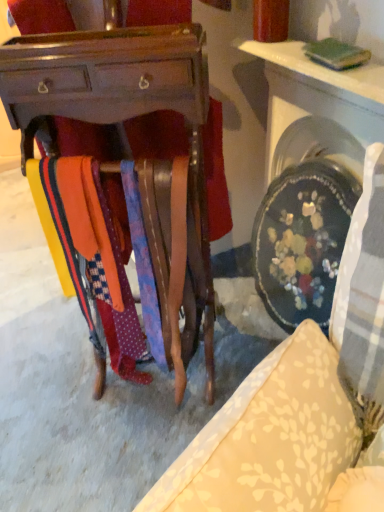
Question: Is wooden tie rack at center completely or partially inside wooden desk at center?

Choices:
 (A) no
 (B) yes

Answer: (A)

Question: Is wooden desk at center thinner than wooden tie rack at center?

Choices:
 (A) no
 (B) yes

Answer: (B)

Question: Is wooden desk at center at the right side of wooden tie rack at center?

Choices:
 (A) yes
 (B) no

Answer: (A)

Question: Is wooden desk at center oriented away from wooden tie rack at center?

Choices:
 (A) no
 (B) yes

Answer: (A)

Question: From a real-world perspective, does wooden desk at center stand above wooden tie rack at center?

Choices:
 (A) yes
 (B) no

Answer: (A)

Question: Considering the relative positions of wooden tie rack at center and orange fabric at center in the image provided, is wooden tie rack at center to the left or to the right of orange fabric at center?

Choices:
 (A) left
 (B) right

Answer: (A)

Question: From their relative heights in the image, would you say wooden tie rack at center is taller or shorter than orange fabric at center?

Choices:
 (A) tall
 (B) short

Answer: (B)

Question: Considering the positions of point (235, 403) and point (117, 354), is point (235, 403) closer or farther from the camera than point (117, 354)?

Choices:
 (A) farther
 (B) closer

Answer: (B)

Question: Relative to orange fabric at center, is wooden tie rack at center in front or behind?

Choices:
 (A) front
 (B) behind

Answer: (B)

Question: From a real-world perspective, relative to white glossy table at upper right, is polka dot fabric tie at center vertically above or below?

Choices:
 (A) above
 (B) below

Answer: (B)

Question: Is polka dot fabric tie at center wider or thinner than white glossy table at upper right?

Choices:
 (A) thin
 (B) wide

Answer: (A)

Question: Is polka dot fabric tie at center in front of or behind white glossy table at upper right in the image?

Choices:
 (A) behind
 (B) front

Answer: (A)

Question: From the image's perspective, relative to white glossy table at upper right, is polka dot fabric tie at center above or below?

Choices:
 (A) below
 (B) above

Answer: (A)

Question: Is wooden desk at center situated inside polka dot fabric tie at center or outside?

Choices:
 (A) outside
 (B) inside

Answer: (A)

Question: From the image's perspective, is wooden desk at center above or below polka dot fabric tie at center?

Choices:
 (A) above
 (B) below

Answer: (A)